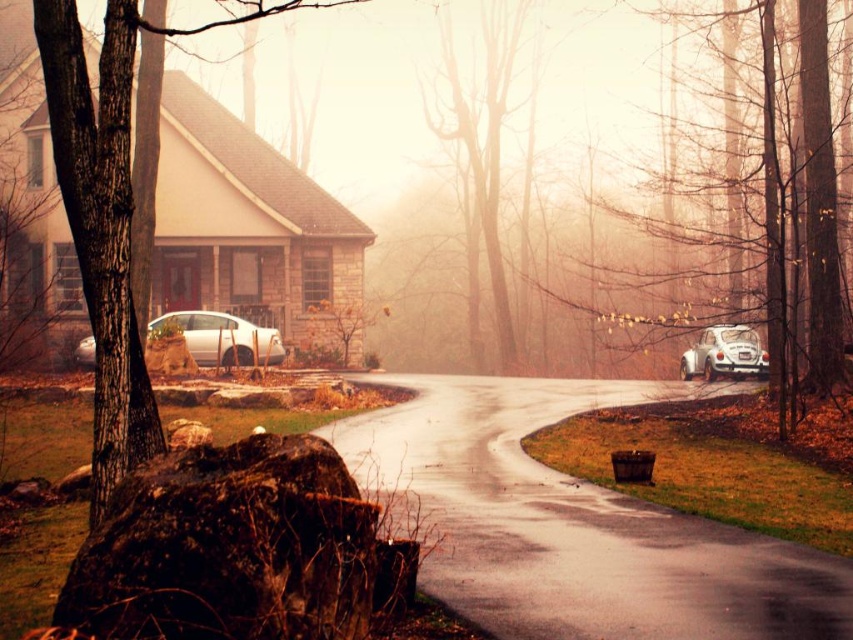
Is point (756, 173) positioned after point (682, 378)?

Yes, it is behind point (682, 378).

What do you see at coordinates (744, 202) in the screenshot?
I see `smooth bark tree at right` at bounding box center [744, 202].

Locate an element on the screen. This screenshot has width=853, height=640. smooth bark tree at right is located at coordinates (744, 202).

Between bare wood tree at center and white matte car at right, which one is positioned higher?

Positioned higher is bare wood tree at center.

Is bare wood tree at center smaller than white matte car at right?

No, bare wood tree at center is not smaller than white matte car at right.

I want to click on bare wood tree at center, so click(485, 141).

What do you see at coordinates (105, 216) in the screenshot? The image size is (853, 640). I see `brown rough tree at left` at bounding box center [105, 216].

Which is in front, point (113, 378) or point (485, 176)?

Positioned in front is point (113, 378).

Find the location of a particular element. The image size is (853, 640). brown rough tree at left is located at coordinates (105, 216).